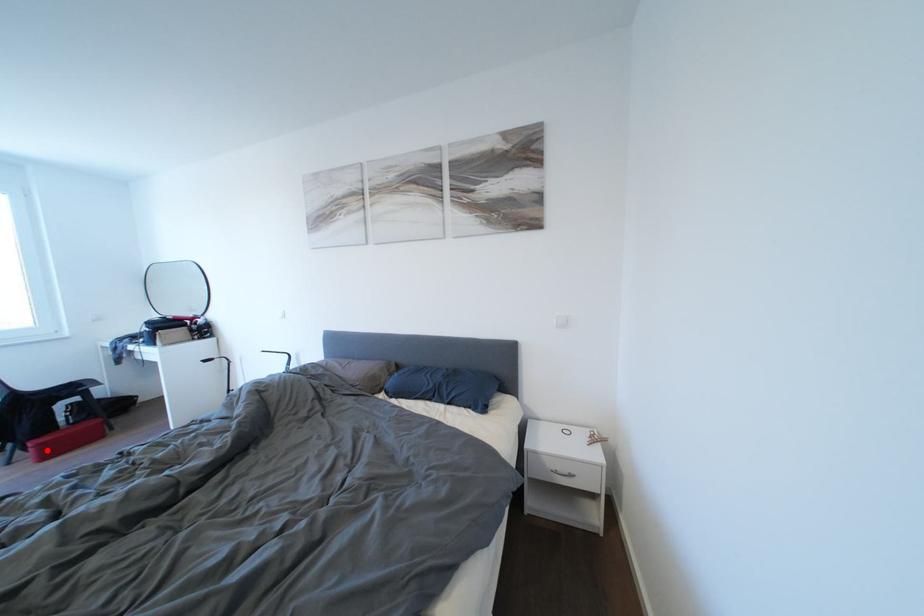
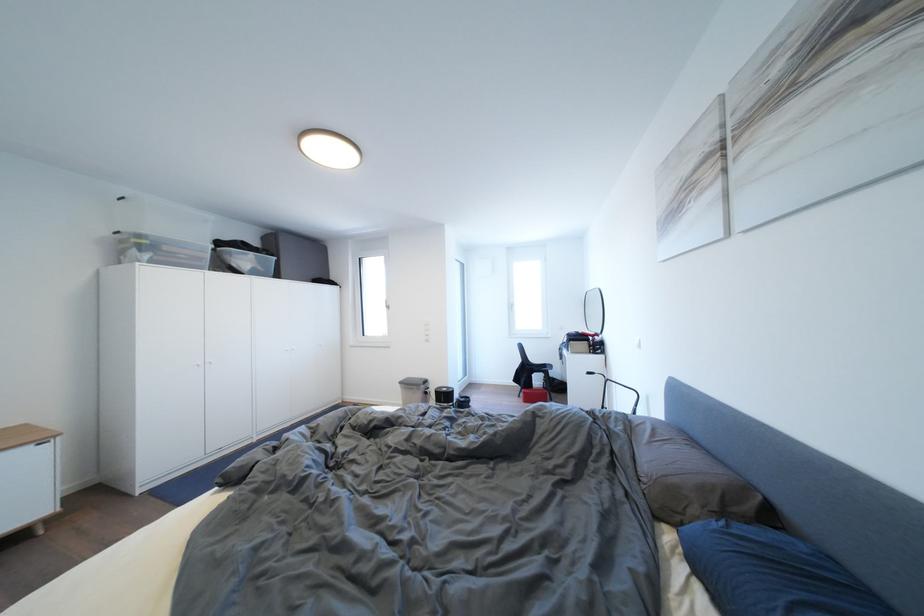
Question: I am providing you with two images of the same scene from different viewpoints. Given a red point in image1, look at the same physical point in image2. Is it:

Choices:
 (A) Closer to the viewpoint
 (B) Farther from the viewpoint

Answer: (B)